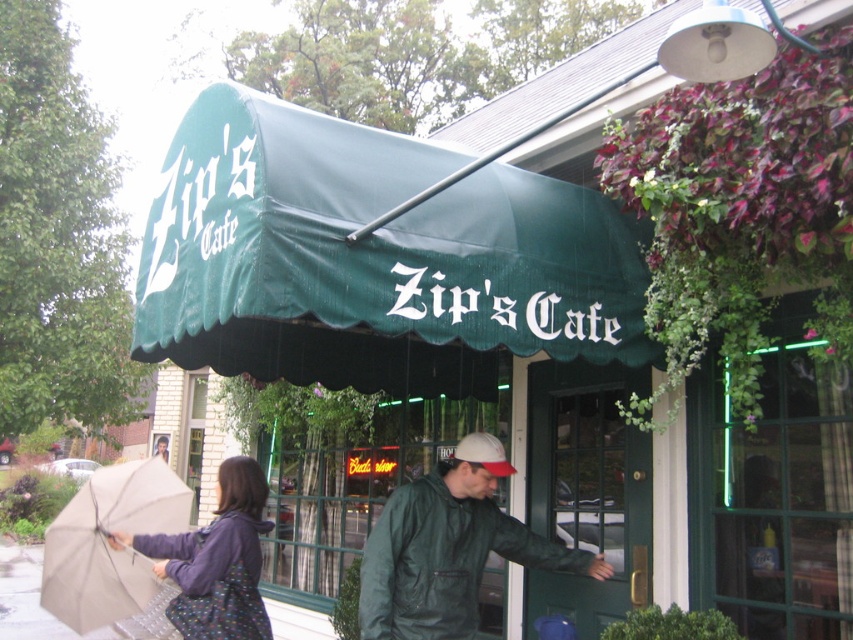
You are standing at point A, which is located at coordinates (370, 259). What object is directly under you?

The green fabric awning at upper center is located at point (370, 259), so the object directly under you is the green fabric awning at upper center.

You are standing at the entrance of Zip Cafe and want to walk towards the two people passing by. According to the image, which of the two points, point (395, 604) or point (112, 636), should you walk towards first?

You should walk towards point (395, 604) first because it is in front of point (112, 636), meaning it is closer to your current position at the entrance.

You are standing at the entrance of Zip Cafe and see the green matte jacket at center and the gray concrete pavement at lower left. Which object is closer to you?

The green matte jacket at center is closer to you because it is located above the gray concrete pavement at lower left, indicating it is positioned nearer in the scene.